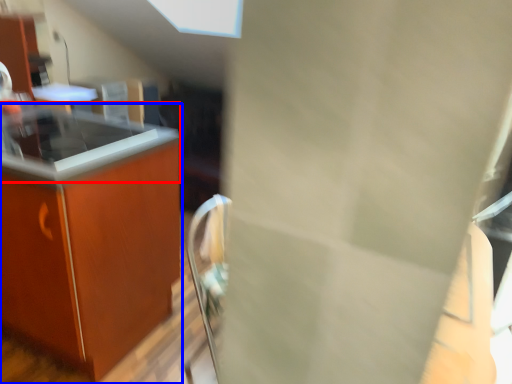
Question: Which of the following is the farthest to the observer, countertop (highlighted by a red box) or countertop (highlighted by a blue box)?

Choices:
 (A) countertop
 (B) countertop

Answer: (A)